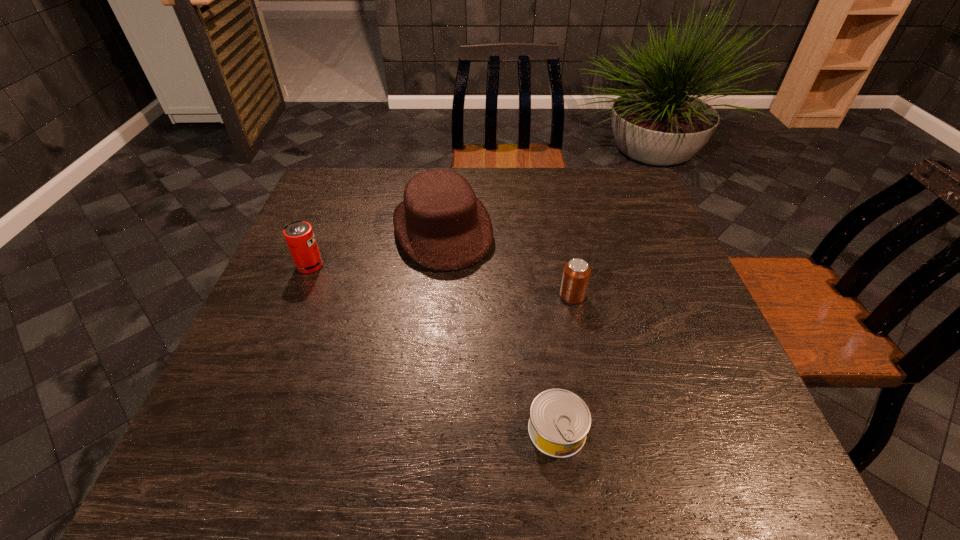
I want to click on hat, so click(441, 225).

Find the location of a particular element. This screenshot has height=540, width=960. the tallest can is located at coordinates (299, 235).

This screenshot has width=960, height=540. Identify the location of the farthest can. (299, 235).

Where is `the second farthest can`? This screenshot has width=960, height=540. the second farthest can is located at coordinates (576, 274).

This screenshot has width=960, height=540. In order to click on the second tallest can in this screenshot , I will do `click(576, 274)`.

Find the location of a particular element. the shortest object is located at coordinates (559, 422).

You are a GUI agent. You are given a task and a screenshot of the screen. Output one action in this format:
    pyautogui.click(x=<x>, y=<y>)
    Task: Click on the nearest can
    This screenshot has width=960, height=540.
    Given the screenshot: What is the action you would take?
    pyautogui.click(x=559, y=422)

The width and height of the screenshot is (960, 540). I want to click on free space located 0.330m on the front of the third object from right to left, so click(x=427, y=389).

Locate an element on the screen. vacant area situated 0.080m on the front of the leftmost object is located at coordinates (297, 298).

This screenshot has width=960, height=540. Identify the location of vacant space positioned on the left of the second nearest object. 433,296.